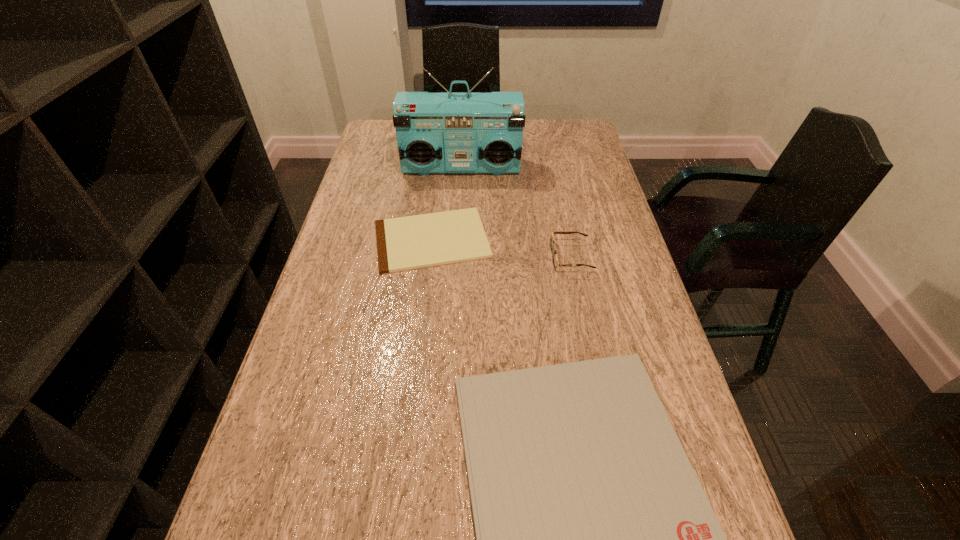
Choose which object is the nearest neighbor to the shorter clipboard. Please provide its 2D coordinates. Your answer should be formatted as a tuple, i.e. [(x, y)], where the tuple contains the x and y coordinates of a point satisfying the conditions above.

[(555, 260)]

Image resolution: width=960 pixels, height=540 pixels. Identify the location of object that ranks as the third closest to the third tallest object. (445, 132).